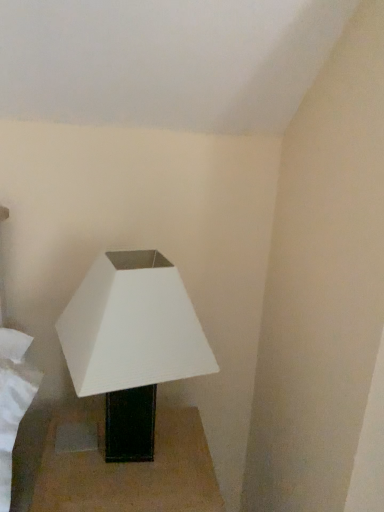
The height and width of the screenshot is (512, 384). In order to click on free point above black glossy table at lower center (from a real-world perspective) in this screenshot , I will do `click(139, 457)`.